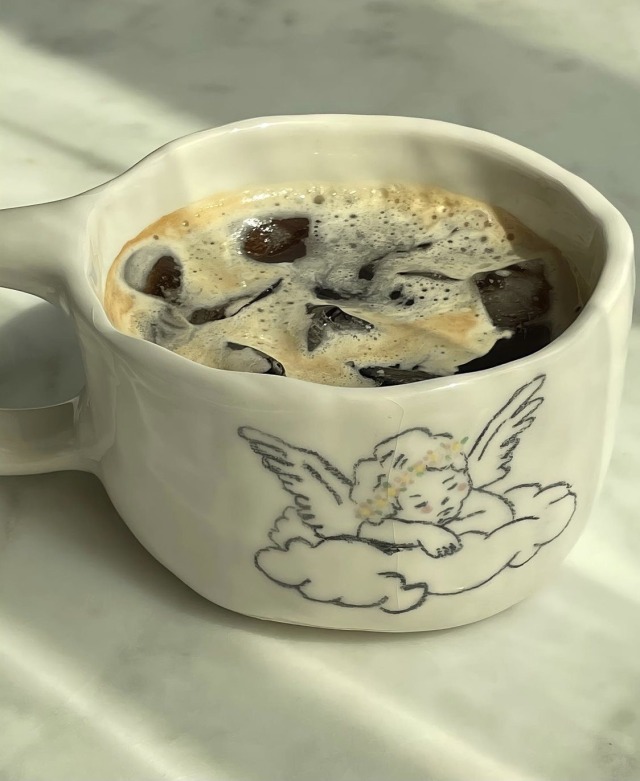
I want to click on handle, so click(41, 436).